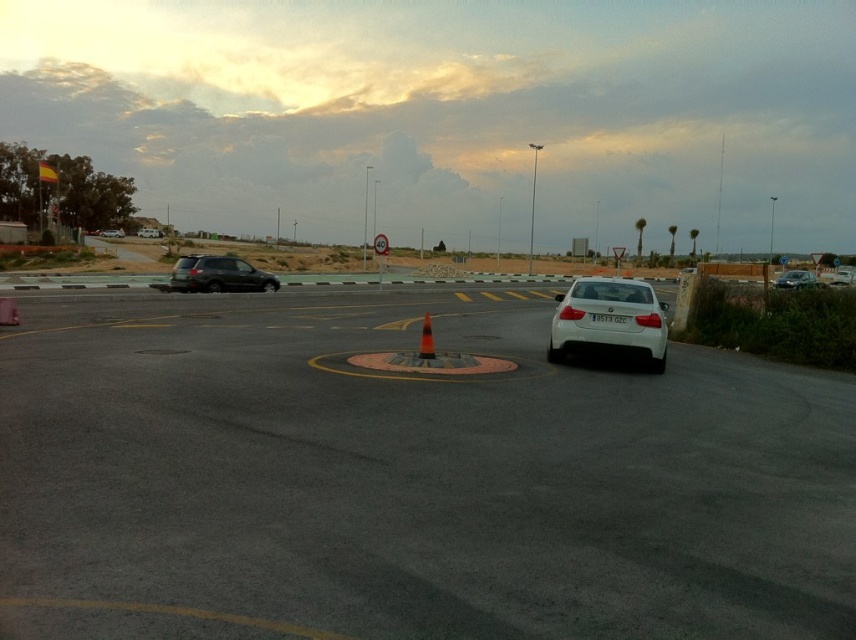
In the scene shown: You are a delivery driver approaching the satin black suv at left and the orange reflective cone at center. Your delivery truck is 25 feet long. Can you safely navigate around both objects without hitting them?

The distance between the satin black suv at left and the orange reflective cone at center is 41.38 feet. Since your truck is 25 feet long, there is enough space to safely navigate around both objects as 41.38 feet is greater than 25 feet.

You are a delivery driver approaching the intersection and need to determine if your 6.5 feet tall truck can pass under a low bridge ahead. The truck is currently next to the satin black suv at left and orange reflective cone at center. Which object can help you estimate the truck height?

The satin black suv at left is much taller than the orange reflective cone at center, so comparing the truck to the suv would give a better estimate of whether it can pass under the bridge.

You are driving a white glossy car at center and want to park it next to the satin silver sedan at center. Given that the parking space is 15 feet wide, can you safely park your car there?

The white glossy car at center is 54.62 feet away from the satin silver sedan at center. Since the parking space is only 15 feet wide, the distance between the cars is much greater than the parking space width, so parking there would not be possible as the cars are too far apart.